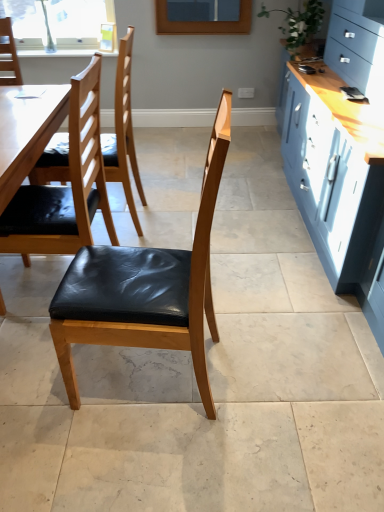
Image resolution: width=384 pixels, height=512 pixels. Find the location of `free point to the right of matte black leather chair at center, positioned as the 3th chair in back-to-front order`. free point to the right of matte black leather chair at center, positioned as the 3th chair in back-to-front order is located at coordinates (256, 373).